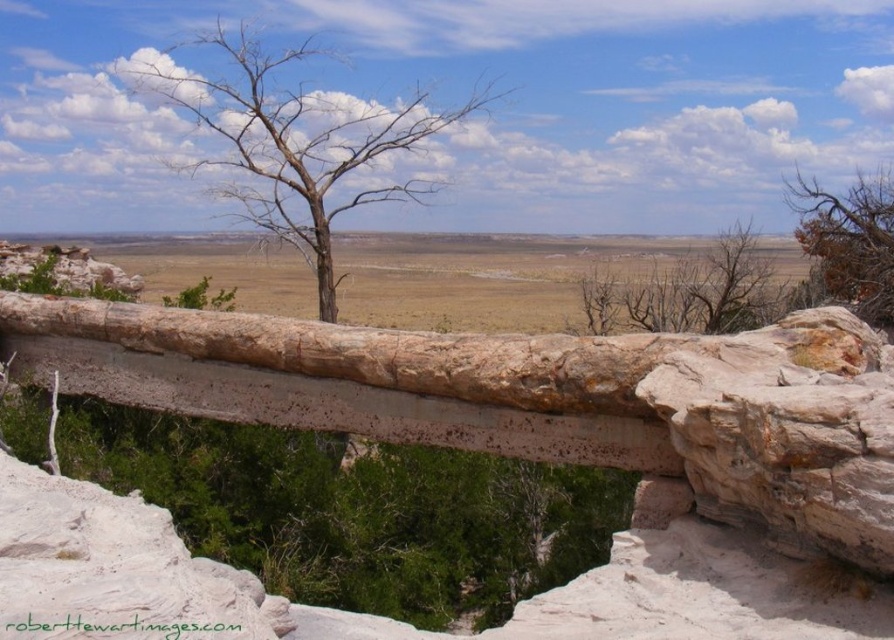
You are standing in the scenic landscape and want to touch both the bare wood tree at center and the brown bark tree at center. Which tree should you approach first to reach the closer one?

You should approach the bare wood tree at center first because it is closer to the viewer than the brown bark tree at center.

Based on the photo, you are an observer standing on the rocky outcrop in the foreground of the scene. You notice two trees at the center of the image. Which tree, the bare wood tree at center or the brown bark tree at center, would appear larger in your field of view?

The bare wood tree at center appears larger in your field of view because it is much taller than the brown bark tree at center.